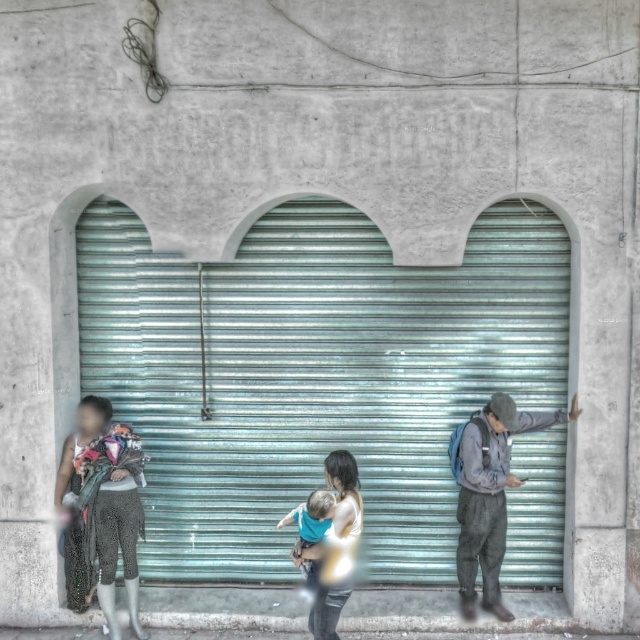
Question: Which of the following is the closest to the observer?

Choices:
 (A) light blue fabric at center
 (B) teal corrugated metal at center
 (C) gray fabric jacket at right
 (D) light blue fabric baby at center

Answer: (A)

Question: Considering the real-world distances, which object is closest to the teal corrugated metal at center?

Choices:
 (A) light blue fabric at center
 (B) gray fabric jacket at right
 (C) sparkly silver pants at left
 (D) light blue fabric baby at center

Answer: (B)

Question: Can you confirm if gray fabric jacket at right is positioned to the left of light blue fabric baby at center?

Choices:
 (A) no
 (B) yes

Answer: (A)

Question: Which point appears closest to the camera in this image?

Choices:
 (A) (314, 586)
 (B) (321, 529)

Answer: (B)

Question: Where is teal corrugated metal at center located in relation to light blue fabric at center in the image?

Choices:
 (A) left
 (B) right

Answer: (A)

Question: Is sparkly silver pants at left positioned behind light blue fabric baby at center?

Choices:
 (A) no
 (B) yes

Answer: (B)